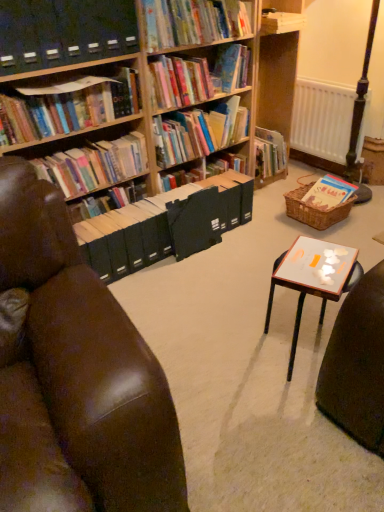
Where is `vacant space underneath white glossy table at center (from a real-world perspective)`? vacant space underneath white glossy table at center (from a real-world perspective) is located at coordinates (298, 350).